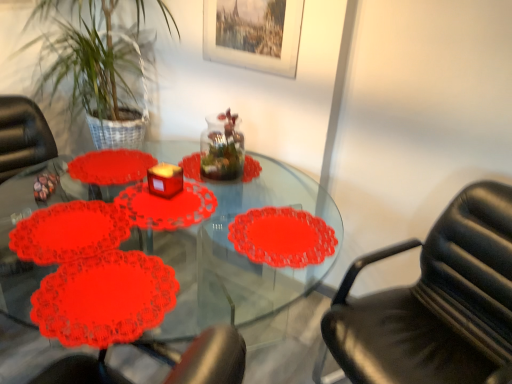
The image size is (512, 384). In order to click on lacy paper doily at lower left in this screenshot , I will do `click(69, 232)`.

Find the location of `matte red candle at center`. matte red candle at center is located at coordinates (165, 180).

The height and width of the screenshot is (384, 512). I want to click on green leafy plant at upper left, so (x=92, y=61).

Is lacy paper doily at lower left positioned in front of wooden picture frame at upper center?

That is True.

In the scene shown: Considering the relative sizes of lacy paper doily at lower left and wooden picture frame at upper center in the image provided, is lacy paper doily at lower left taller than wooden picture frame at upper center?

No.

Is lacy paper doily at lower left facing away from wooden picture frame at upper center?

No, lacy paper doily at lower left's orientation is not away from wooden picture frame at upper center.

Is lacy paper doily at lower left outside of wooden picture frame at upper center?

Yes, lacy paper doily at lower left is located beyond the bounds of wooden picture frame at upper center.

Is matte red candle at center far away from matte red doilies at center?

matte red candle at center is near matte red doilies at center, not far away.

Is matte red candle at center oriented towards matte red doilies at center?

No.

Which object is thinner, matte red candle at center or matte red doilies at center?

matte red candle at center is thinner.

Considering the relative sizes of wooden picture frame at upper center and matte red candle at center in the image provided, is wooden picture frame at upper center taller than matte red candle at center?

Indeed, wooden picture frame at upper center has a greater height compared to matte red candle at center.

Does point (242, 15) come in front of point (166, 191)?

No, (242, 15) is behind (166, 191).

Is wooden picture frame at upper center not close to matte red candle at center?

That's not correct — wooden picture frame at upper center is a little close to matte red candle at center.

From a real-world perspective, is wooden picture frame at upper center physically above matte red candle at center?

Yes.

Which object is wider, matte red candle at center or green leafy plant at upper left?

With larger width is green leafy plant at upper left.

Who is taller, matte red candle at center or green leafy plant at upper left?

With more height is green leafy plant at upper left.

From a real-world perspective, is matte red candle at center physically located above or below green leafy plant at upper left?

matte red candle at center is situated lower than green leafy plant at upper left in the real world.

Is transparent glass jar at center beside matte red candle at center?

No.

Is transparent glass jar at center outside of matte red candle at center?

Yes.

Is transparent glass jar at center oriented towards matte red candle at center?

No, transparent glass jar at center does not turn towards matte red candle at center.

Looking at this image, between transparent glass jar at center and matte red candle at center, which one appears on the right side from the viewer's perspective?

From the viewer's perspective, transparent glass jar at center appears more on the right side.

Which is closer, (236, 290) or (217, 129)?

Point (236, 290) appears to be farther away from the viewer than point (217, 129).

Is transparent glass jar at center located within matte red doilies at center?

That's incorrect, transparent glass jar at center is not inside matte red doilies at center.

Considering the relative positions of matte red doilies at center and transparent glass jar at center in the image provided, is matte red doilies at center to the right of transparent glass jar at center from the viewer's perspective?

No, matte red doilies at center is not to the right of transparent glass jar at center.

Considering the relative sizes of wooden picture frame at upper center and transparent glass jar at center in the image provided, is wooden picture frame at upper center thinner than transparent glass jar at center?

Yes.

Considering the points (233, 9) and (215, 160), which point is behind, point (233, 9) or point (215, 160)?

The point (233, 9) is more distant.

The width and height of the screenshot is (512, 384). I want to click on glass vase below the wooden picture frame at upper center (from a real-world perspective), so click(x=222, y=148).

From a real-world perspective, is wooden picture frame at upper center beneath transparent glass jar at center?

No, from a real-world perspective, wooden picture frame at upper center is not below transparent glass jar at center.

Find the location of a particular element. This screenshot has height=384, width=512. flower lying in front of the wooden picture frame at upper center is located at coordinates (69, 232).

Identify the location of candle holder above the matte red doilies at center (from a real-world perspective). Image resolution: width=512 pixels, height=384 pixels. (165, 180).

Based on their spatial positions, is black leather chair at right or green leafy plant at upper left further from lacy paper doily at lower left?

black leather chair at right lies further to lacy paper doily at lower left than the other object.

From the image, which object appears to be farther from green leafy plant at upper left, wooden picture frame at upper center or black leather chair at right?

black leather chair at right is further to green leafy plant at upper left.

From the image, which object appears to be nearer to lacy paper doily at lower left, matte red candle at center or transparent glass jar at center?

matte red candle at center is closer to lacy paper doily at lower left.

When comparing their distances from matte red candle at center, does lacy paper doily at lower left or green leafy plant at upper left seem closer?

lacy paper doily at lower left lies closer to matte red candle at center than the other object.

From the image, which object appears to be farther from transparent glass jar at center, matte red candle at center or black leather chair at right?

black leather chair at right is further to transparent glass jar at center.

Looking at this image, estimate the real-world distances between objects in this image. Which object is closer to matte red candle at center, matte red doilies at center or transparent glass jar at center?

transparent glass jar at center.

Which object lies further to the anchor point transparent glass jar at center, lacy paper doily at lower left or matte red doilies at center?

Among the two, matte red doilies at center is located further to transparent glass jar at center.

Based on their spatial positions, is black leather chair at right or matte red candle at center further from lacy paper doily at lower left?

Among the two, black leather chair at right is located further to lacy paper doily at lower left.

The height and width of the screenshot is (384, 512). In order to click on glass vase between green leafy plant at upper left and black leather chair at right from left to right in this screenshot , I will do `click(222, 148)`.

Locate an element on the screen. This screenshot has height=384, width=512. plant located between matte red doilies at center and matte red candle at center in the depth direction is located at coordinates (92, 61).

Where is `candle holder between wooden picture frame at upper center and black leather chair at right from top to bottom`? candle holder between wooden picture frame at upper center and black leather chair at right from top to bottom is located at coordinates (165, 180).

Locate an element on the screen. This screenshot has height=384, width=512. flower between matte red doilies at center and matte red candle at center along the z-axis is located at coordinates (69, 232).